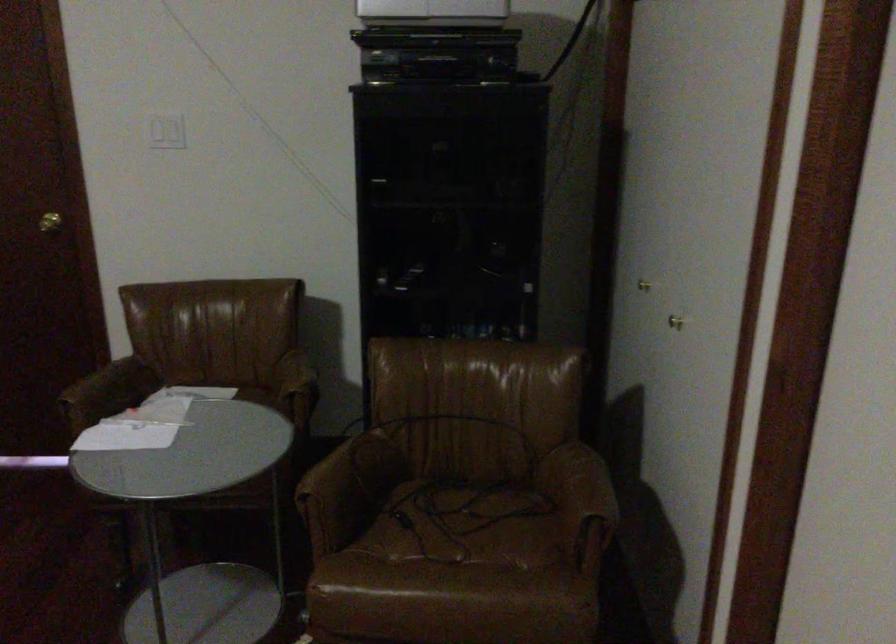
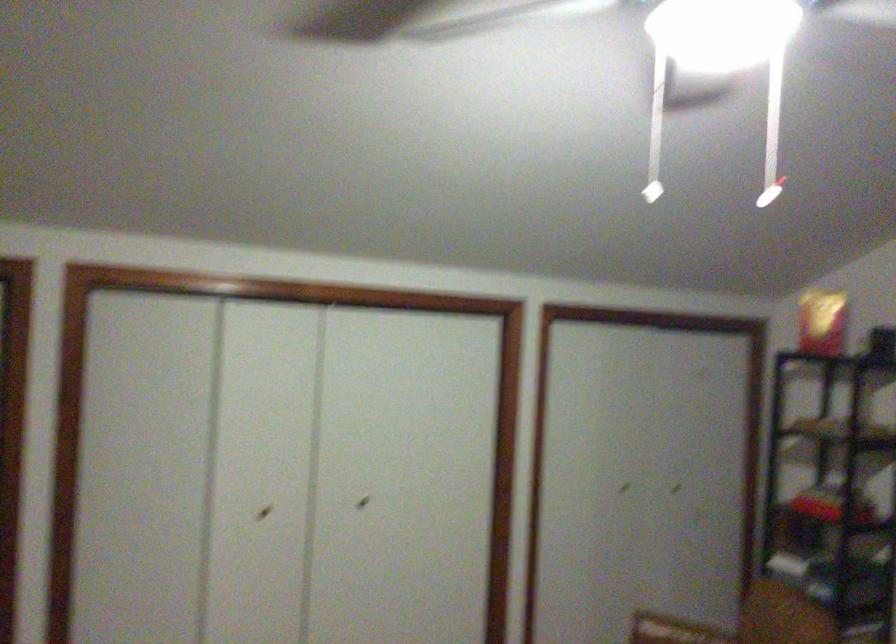
Question: Based on the continuous images, in which direction is the camera rotating? Reply with the corresponding letter.

Choices:
 (A) Left
 (B) Right
 (C) Up
 (D) Down

Answer: (A)